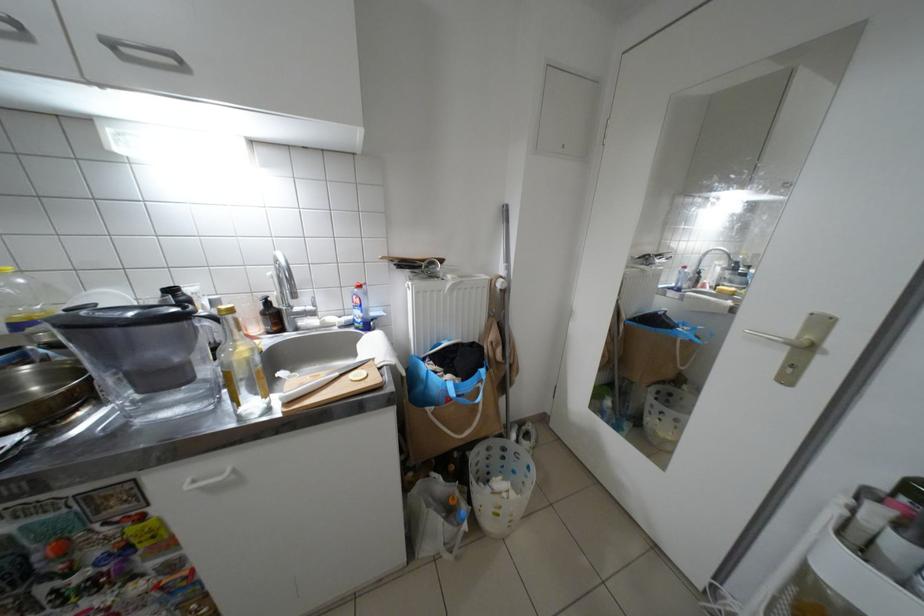
At what (x,y) coordinates should I click in order to perform the action: click on blue bag handle. Please return your answer as a coordinate pair (x, y). The width and height of the screenshot is (924, 616). Looking at the image, I should click on (468, 387).